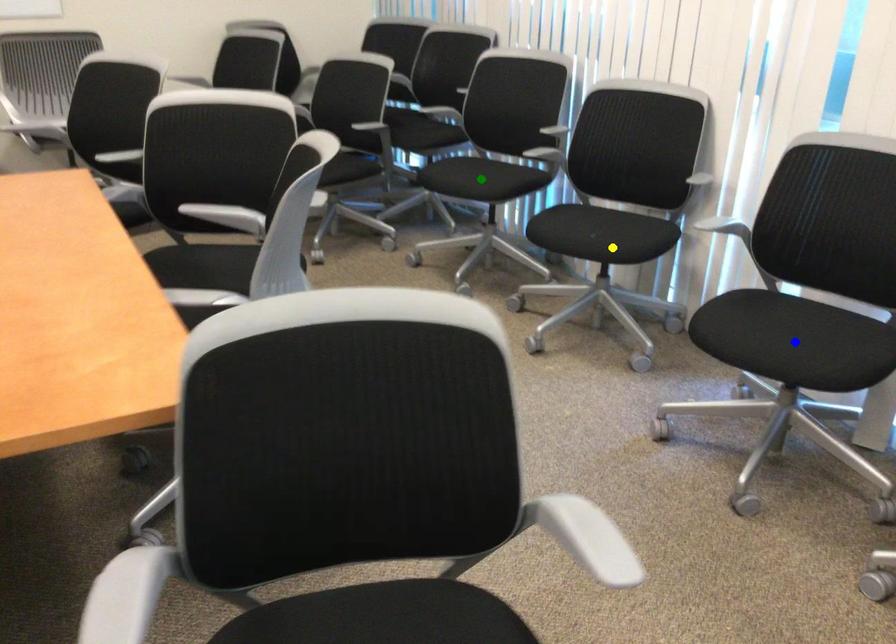
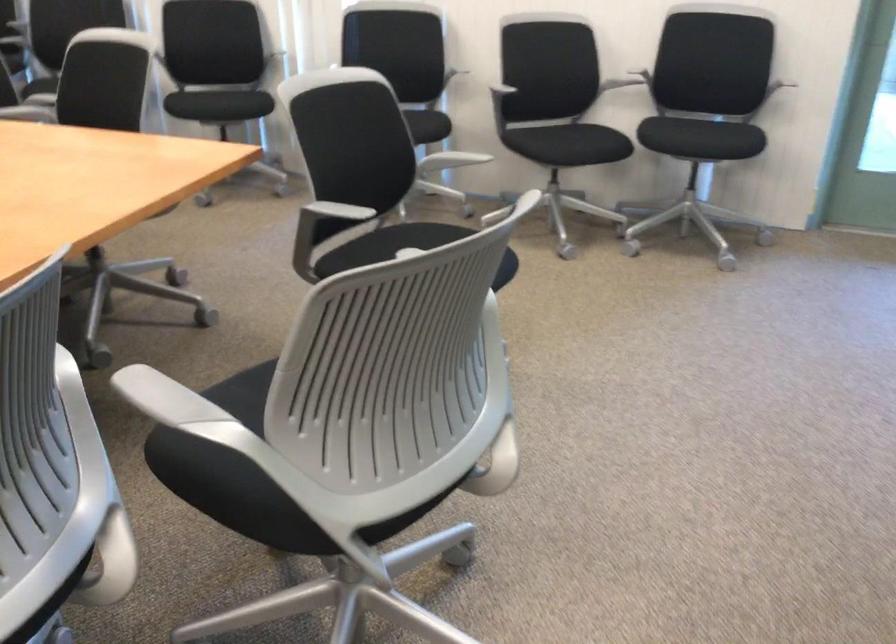
I am providing you with two images of the same scene from different viewpoints. Three points are marked in image1. Which point corresponds to a part or object that is occluded in image2?In image1, three points are marked. Which of them correspond to a part or object that is occluded in image2?Among the three points shown in image1, which one corresponds to a part or object that is no longer visible due to occlusion in image2?

Invisible in image2: blue point, green point.